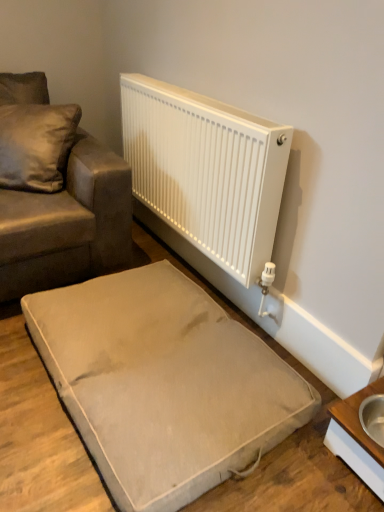
Question: From the image's perspective, is beige fabric dog bed at lower center located above white wood table at lower right?

Choices:
 (A) no
 (B) yes

Answer: (B)

Question: Can you confirm if beige fabric dog bed at lower center is positioned to the right of white wood table at lower right?

Choices:
 (A) no
 (B) yes

Answer: (A)

Question: Is beige fabric dog bed at lower center beside white wood table at lower right?

Choices:
 (A) yes
 (B) no

Answer: (B)

Question: From the image's perspective, is beige fabric dog bed at lower center located beneath white wood table at lower right?

Choices:
 (A) no
 (B) yes

Answer: (A)

Question: Can you confirm if beige fabric dog bed at lower center is wider than white wood table at lower right?

Choices:
 (A) yes
 (B) no

Answer: (A)

Question: Considering the relative sizes of beige fabric dog bed at lower center and white wood table at lower right in the image provided, is beige fabric dog bed at lower center taller than white wood table at lower right?

Choices:
 (A) yes
 (B) no

Answer: (B)

Question: Considering the relative positions of satin cushion at upper left and white wood table at lower right in the image provided, is satin cushion at upper left to the right of white wood table at lower right from the viewer's perspective?

Choices:
 (A) no
 (B) yes

Answer: (A)

Question: From the image's perspective, is satin cushion at upper left above white wood table at lower right?

Choices:
 (A) yes
 (B) no

Answer: (A)

Question: Is satin cushion at upper left oriented away from white wood table at lower right?

Choices:
 (A) yes
 (B) no

Answer: (B)

Question: From the image's perspective, would you say satin cushion at upper left is shown under white wood table at lower right?

Choices:
 (A) no
 (B) yes

Answer: (A)

Question: Considering the relative sizes of satin cushion at upper left and white wood table at lower right in the image provided, is satin cushion at upper left shorter than white wood table at lower right?

Choices:
 (A) yes
 (B) no

Answer: (B)

Question: From a real-world perspective, is satin cushion at upper left below white wood table at lower right?

Choices:
 (A) no
 (B) yes

Answer: (A)

Question: Considering the relative sizes of satin cushion at upper left and beige fabric dog bed at lower center in the image provided, is satin cushion at upper left wider than beige fabric dog bed at lower center?

Choices:
 (A) yes
 (B) no

Answer: (B)